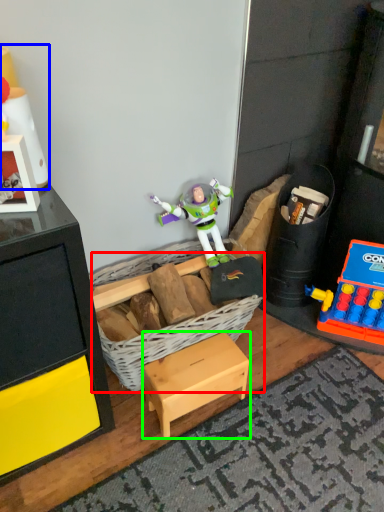
Question: Which object is the farthest from basket (highlighted by a red box)? Choose among these: toy (highlighted by a blue box) or furniture (highlighted by a green box).

Choices:
 (A) toy
 (B) furniture

Answer: (A)